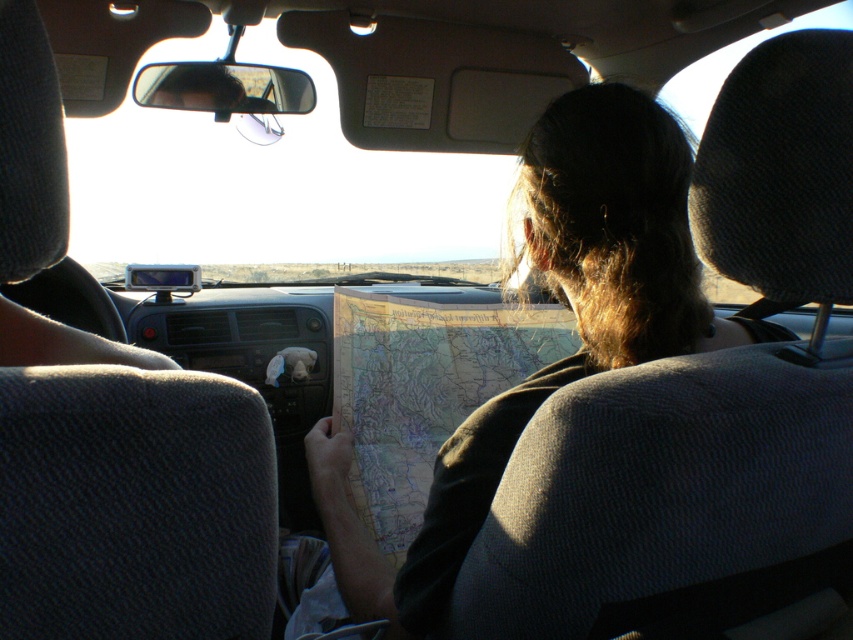
Question: Which object appears closest to the camera in this image?

Choices:
 (A) yellowed paper map at center
 (B) brown paper map at center

Answer: (B)

Question: Does brown paper map at center have a greater width compared to yellowed paper map at center?

Choices:
 (A) no
 (B) yes

Answer: (B)

Question: Which of the following is the closest to the observer?

Choices:
 (A) brown paper map at center
 (B) yellowed paper map at center

Answer: (A)

Question: Is brown paper map at center bigger than yellowed paper map at center?

Choices:
 (A) yes
 (B) no

Answer: (A)

Question: Is brown paper map at center further to camera compared to yellowed paper map at center?

Choices:
 (A) no
 (B) yes

Answer: (A)

Question: Which of the following is the closest to the observer?

Choices:
 (A) brown paper map at center
 (B) yellowed paper map at center

Answer: (A)